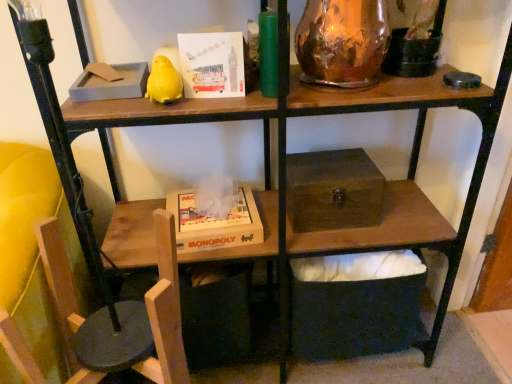
Identify the location of wooden monopoly game at lower center. (131, 234).

What do you see at coordinates (165, 314) in the screenshot?
I see `wooden swivel chair at lower left` at bounding box center [165, 314].

This screenshot has height=384, width=512. What do you see at coordinates (383, 227) in the screenshot? I see `wooden chair at lower left` at bounding box center [383, 227].

At what (x,y) coordinates should I click in order to perform the action: click on wooden box at center, placed as the second box when sorted from top to bottom. Please return your answer as a coordinate pair (x, y). The image size is (512, 384). Looking at the image, I should click on (356, 304).

From the image's perspective, would you say matte paper card at upper center is positioned over brown wooden box at center, which ranks as the 1th box in top-to-bottom order?

Yes.

Is matte paper card at upper center next to brown wooden box at center, which ranks as the 1th box in top-to-bottom order?

No.

From the picture: How distant is matte paper card at upper center from brown wooden box at center, arranged as the 2th box when ordered from the bottom?

They are 39.26 centimeters apart.

Which object is further away from the camera, matte paper card at upper center or brown wooden box at center, which ranks as the 1th box in top-to-bottom order?

Positioned behind is brown wooden box at center, which ranks as the 1th box in top-to-bottom order.

Is wooden swivel chair at lower left inside the boundaries of wooden box at center, acting as the first box starting from the bottom, or outside?

The correct answer is: outside.

Is wooden swivel chair at lower left to the right of wooden box at center, acting as the first box starting from the bottom, from the viewer's perspective?

No.

Which object is further away from the camera, wooden swivel chair at lower left or wooden box at center, placed as the second box when sorted from top to bottom?

wooden box at center, placed as the second box when sorted from top to bottom.

Considering the sizes of objects wooden swivel chair at lower left and wooden box at center, placed as the second box when sorted from top to bottom, in the image provided, who is shorter, wooden swivel chair at lower left or wooden box at center, placed as the second box when sorted from top to bottom,?

Standing shorter between the two is wooden box at center, placed as the second box when sorted from top to bottom.

What's the angular difference between copper metallic vase at upper right and wooden monopoly game at lower center's facing directions?

The angular difference between copper metallic vase at upper right and wooden monopoly game at lower center is 7.98 degrees.

From the image's perspective, is copper metallic vase at upper right on wooden monopoly game at lower center?

Yes.

Which is correct: copper metallic vase at upper right is inside wooden monopoly game at lower center, or outside of it?

copper metallic vase at upper right cannot be found inside wooden monopoly game at lower center.

Considering the positions of point (366, 57) and point (106, 250), is point (366, 57) closer or farther from the camera than point (106, 250)?

Point (366, 57) is positioned closer to the camera compared to point (106, 250).

Does copper metallic vase at upper right have a lesser height compared to wooden swivel chair at lower left?

Correct, copper metallic vase at upper right is not as tall as wooden swivel chair at lower left.

Can you tell me how much copper metallic vase at upper right and wooden swivel chair at lower left differ in facing direction?

The angle between the facing direction of copper metallic vase at upper right and the facing direction of wooden swivel chair at lower left is 8.91 degrees.

This screenshot has height=384, width=512. I want to click on glass vase on the right of wooden swivel chair at lower left, so click(342, 42).

Can you confirm if copper metallic vase at upper right is thinner than wooden swivel chair at lower left?

Correct, the width of copper metallic vase at upper right is less than that of wooden swivel chair at lower left.

Who is taller, wooden chair at lower left or brown wooden box at center, which ranks as the 1th box in top-to-bottom order?

brown wooden box at center, which ranks as the 1th box in top-to-bottom order.

Would you say wooden chair at lower left contains brown wooden box at center, which ranks as the 1th box in top-to-bottom order?

Definitely not — brown wooden box at center, which ranks as the 1th box in top-to-bottom order, is not inside wooden chair at lower left.

Where is `computer desk below the brown wooden box at center, which ranks as the 1th box in top-to-bottom order (from the image's perspective)`? computer desk below the brown wooden box at center, which ranks as the 1th box in top-to-bottom order (from the image's perspective) is located at coordinates (383, 227).

From the image's perspective, between wooden chair at lower left and brown wooden box at center, which ranks as the 1th box in top-to-bottom order, who is located below?

wooden chair at lower left.

Is point (118, 206) closer or farther from the camera than point (148, 202)?

Point (118, 206) appears to be closer to the viewer than point (148, 202).

Would you say wooden monopoly game at lower center is a long distance from wooden chair at lower left?

wooden monopoly game at lower center is actually quite close to wooden chair at lower left.

How many degrees apart are the facing directions of wooden monopoly game at lower center and wooden chair at lower left?

There is a 84-degree angle between the facing directions of wooden monopoly game at lower center and wooden chair at lower left.

Can you confirm if wooden monopoly game at lower center is bigger than wooden chair at lower left?

Actually, wooden monopoly game at lower center might be smaller than wooden chair at lower left.

Is wooden monopoly game at lower center bigger than brown wooden box at center, which ranks as the 1th box in top-to-bottom order?

Indeed, wooden monopoly game at lower center has a larger size compared to brown wooden box at center, which ranks as the 1th box in top-to-bottom order.

Measure the distance between wooden monopoly game at lower center and brown wooden box at center, arranged as the 2th box when ordered from the bottom.

wooden monopoly game at lower center and brown wooden box at center, arranged as the 2th box when ordered from the bottom, are 25.14 centimeters apart from each other.

From the image's perspective, is wooden monopoly game at lower center located beneath brown wooden box at center, which ranks as the 1th box in top-to-bottom order?

Indeed, from the image's perspective, wooden monopoly game at lower center is shown beneath brown wooden box at center, which ranks as the 1th box in top-to-bottom order.

Locate an element on the screen. paperback book lying on the left of brown wooden box at center, arranged as the 2th box when ordered from the bottom is located at coordinates (212, 64).

Where is `the 2nd box behind when counting from the wooden swivel chair at lower left`? This screenshot has height=384, width=512. the 2nd box behind when counting from the wooden swivel chair at lower left is located at coordinates (356, 304).

Estimate the real-world distances between objects in this image. Which object is further from matte paper card at upper center, brown wooden box at center, which ranks as the 1th box in top-to-bottom order, or wooden box at center, acting as the first box starting from the bottom?

The object further to matte paper card at upper center is wooden box at center, acting as the first box starting from the bottom.

Estimate the real-world distances between objects in this image. Which object is closer to wooden monopoly game at lower center, matte paper card at upper center or brown wooden box at center, arranged as the 2th box when ordered from the bottom?

brown wooden box at center, arranged as the 2th box when ordered from the bottom, is closer to wooden monopoly game at lower center.

Based on their spatial positions, is wooden monopoly game at lower center or wooden swivel chair at lower left closer to matte paper card at upper center?

wooden swivel chair at lower left lies closer to matte paper card at upper center than the other object.

When comparing their distances from wooden monopoly game at lower center, does wooden swivel chair at lower left or wooden box at center, acting as the first box starting from the bottom, seem further?

wooden box at center, acting as the first box starting from the bottom, is further to wooden monopoly game at lower center.

From the image, which object appears to be farther from wooden monopoly game at lower center, wooden swivel chair at lower left or brown wooden box at center, arranged as the 2th box when ordered from the bottom?

wooden swivel chair at lower left is positioned further to the anchor wooden monopoly game at lower center.

Based on the photo, from the image, which object appears to be nearer to matte paper card at upper center, wooden chair at lower left or brown wooden box at center, arranged as the 2th box when ordered from the bottom?

brown wooden box at center, arranged as the 2th box when ordered from the bottom, is positioned closer to the anchor matte paper card at upper center.

Which object lies further to the anchor point matte paper card at upper center, brown wooden box at center, arranged as the 2th box when ordered from the bottom, or copper metallic vase at upper right?

Based on the image, brown wooden box at center, arranged as the 2th box when ordered from the bottom, appears to be further to matte paper card at upper center.

Which object lies nearer to the anchor point copper metallic vase at upper right, wooden swivel chair at lower left or wooden box at center, placed as the second box when sorted from top to bottom?

Based on the image, wooden swivel chair at lower left appears to be nearer to copper metallic vase at upper right.

Identify the location of paperback book that lies between copper metallic vase at upper right and wooden monopoly game at lower center from top to bottom. (212, 64).

The width and height of the screenshot is (512, 384). I want to click on swivel chair between matte paper card at upper center and wooden chair at lower left in the vertical direction, so click(x=165, y=314).

Identify the location of table situated between wooden swivel chair at lower left and wooden box at center, acting as the first box starting from the bottom, from left to right. The height and width of the screenshot is (384, 512). (131, 234).

Find the location of a particular element. The image size is (512, 384). table between copper metallic vase at upper right and wooden chair at lower left vertically is located at coordinates (131, 234).